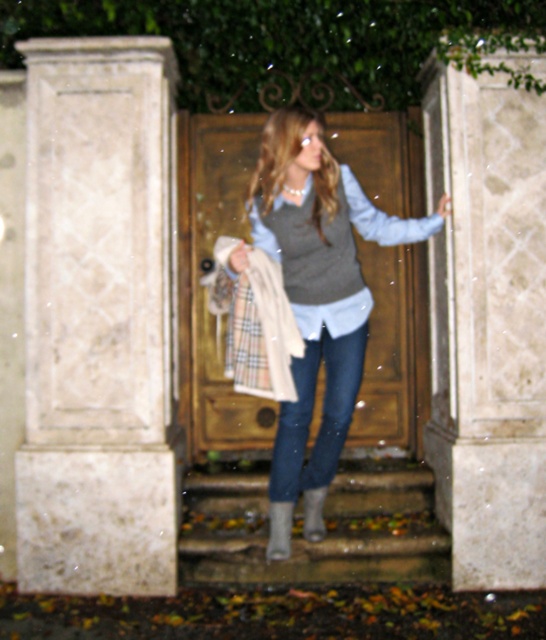
Question: Can you confirm if matte gray vest at center is positioned to the left of grey suede boot at lower center?

Choices:
 (A) no
 (B) yes

Answer: (A)

Question: Is the position of marble column at center less distant than that of leather boot at lower center?

Choices:
 (A) no
 (B) yes

Answer: (A)

Question: Which point is closer to the camera?

Choices:
 (A) tap(470, 296)
 (B) tap(354, 252)

Answer: (B)

Question: Can you confirm if marble column at center is positioned below matte gray vest at center?

Choices:
 (A) yes
 (B) no

Answer: (A)

Question: Which point appears farthest from the camera in this image?

Choices:
 (A) (276, 376)
 (B) (290, 451)
 (C) (169, 170)

Answer: (C)

Question: Which of the following is the closest to the observer?

Choices:
 (A) denim jeans at center
 (B) matte gray vest at center

Answer: (B)